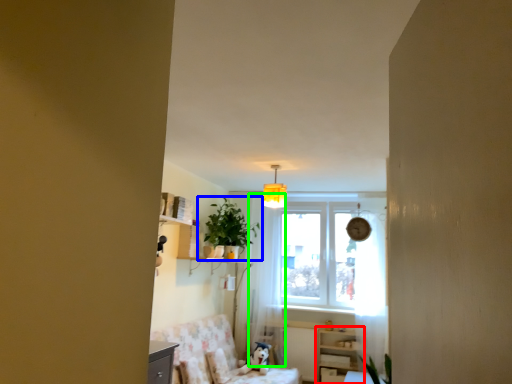
Question: Which object is the farthest from dresser (highlighted by a red box)? Choose among these: houseplant (highlighted by a blue box) or curtain (highlighted by a green box).

Choices:
 (A) houseplant
 (B) curtain

Answer: (A)